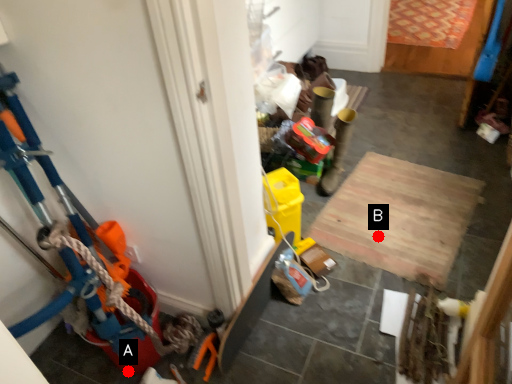
Question: Two points are circled on the image, labeled by A and B beside each circle. Which of the following is the closest to the observer?

Choices:
 (A) A is closer
 (B) B is closer

Answer: (A)